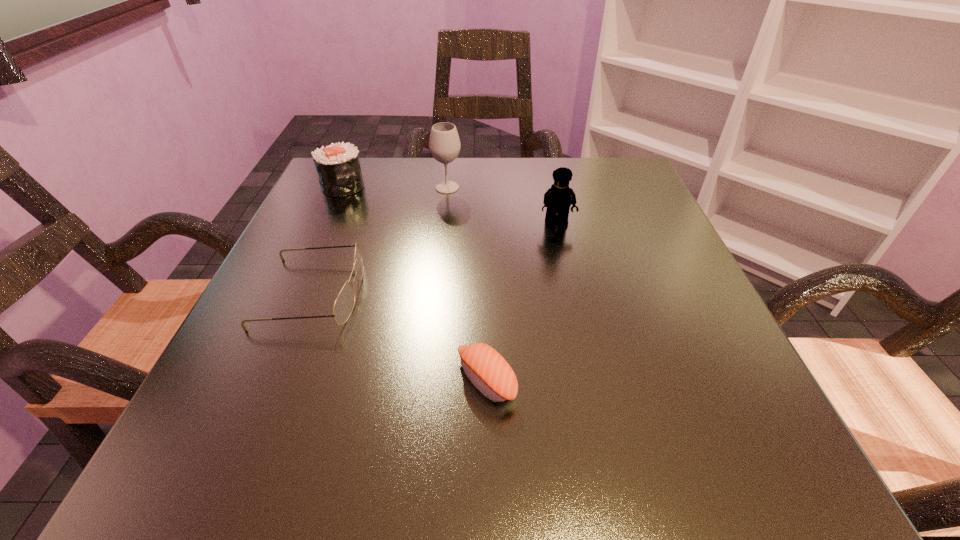
In the image, there is a desktop. Where is `free region at the left edge`? free region at the left edge is located at coordinates click(x=309, y=261).

Locate an element on the screen. The width and height of the screenshot is (960, 540). free spot at the right edge of the desktop is located at coordinates (695, 276).

In the image, there is a desktop. Where is `free space at the far left corner`? free space at the far left corner is located at coordinates (319, 183).

The width and height of the screenshot is (960, 540). What are the coordinates of `free spot at the near left corner of the desktop` in the screenshot? It's located at (277, 467).

Find the location of a particular element. vacant area at the far right corner is located at coordinates (597, 208).

The width and height of the screenshot is (960, 540). Find the location of `blank region between the fourth shortest object and the nearest object`. blank region between the fourth shortest object and the nearest object is located at coordinates (521, 302).

Where is `empty space that is in between the third object from right to left and the fourth shortest object`? Image resolution: width=960 pixels, height=540 pixels. empty space that is in between the third object from right to left and the fourth shortest object is located at coordinates (502, 205).

Where is `vacant area that lies between the fourth farthest object and the taller sushi`? vacant area that lies between the fourth farthest object and the taller sushi is located at coordinates (327, 239).

Find the location of `unoccupied area between the rightmost object and the third object from right to left`. unoccupied area between the rightmost object and the third object from right to left is located at coordinates (502, 205).

Image resolution: width=960 pixels, height=540 pixels. I want to click on free space between the right sushi and the rightmost object, so click(x=521, y=302).